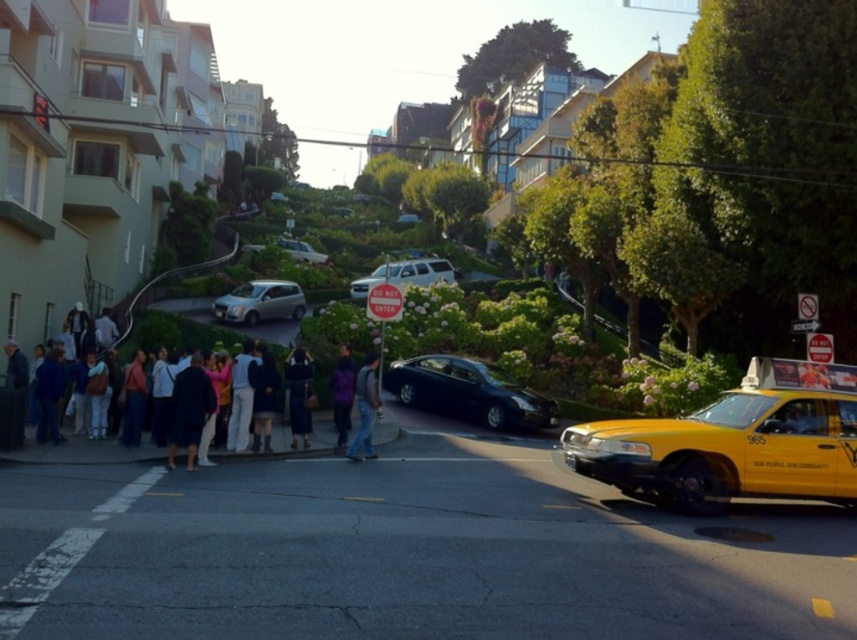
Which of these two, dark blue fabric at center or silver metallic car at center, stands taller?

dark blue fabric at center is taller.

Which is more to the right, dark blue fabric at center or silver metallic car at center?

dark blue fabric at center

What do you see at coordinates (298, 396) in the screenshot?
I see `dark blue fabric at center` at bounding box center [298, 396].

At what (x,y) coordinates should I click in order to perform the action: click on dark blue fabric at center. Please return your answer as a coordinate pair (x, y). The image size is (857, 640). Looking at the image, I should click on (298, 396).

Consider the image. Can you confirm if glossy black sedan at center is positioned to the right of denim jeans at center?

Indeed, glossy black sedan at center is positioned on the right side of denim jeans at center.

Does point (420, 387) come closer to viewer compared to point (370, 372)?

No.

Locate an element on the screen. The width and height of the screenshot is (857, 640). glossy black sedan at center is located at coordinates (468, 392).

Which of these two, dark blue jeans at lower center or dark blue fabric at center, stands taller?

dark blue jeans at lower center is taller.

Does dark blue jeans at lower center appear over dark blue fabric at center?

Correct, dark blue jeans at lower center is located above dark blue fabric at center.

Which is in front, point (27, 428) or point (303, 392)?

Positioned in front is point (303, 392).

Locate an element on the screen. The image size is (857, 640). dark blue jeans at lower center is located at coordinates (81, 452).